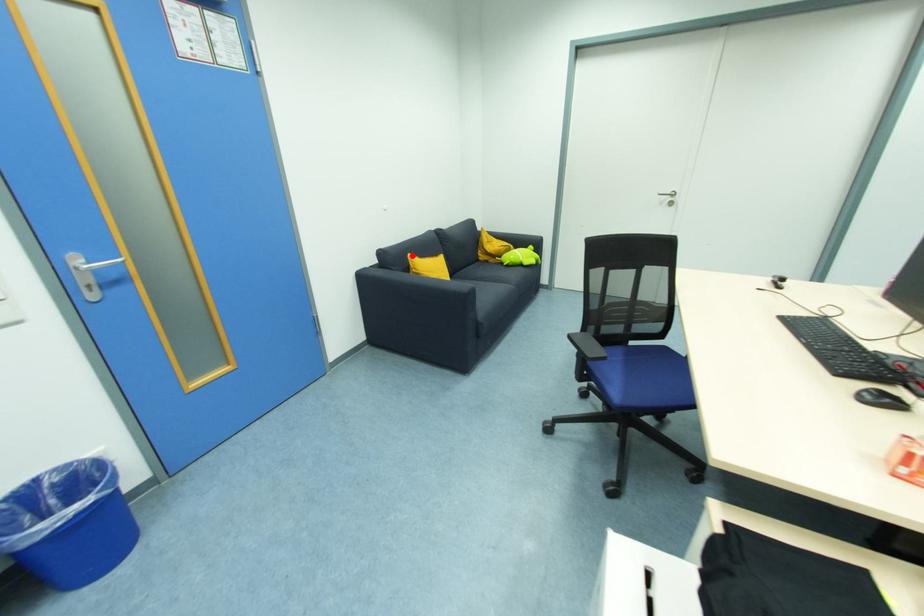
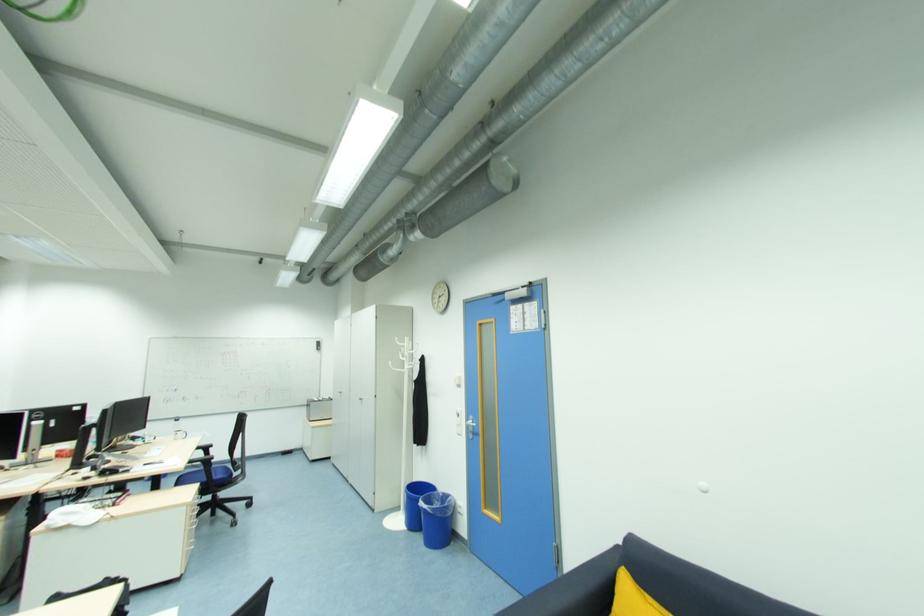
Question: I am providing you with two images of the same scene from different viewpoints. Given a red point in image1, look at the same physical point in image2. Is it:

Choices:
 (A) Closer to the viewpoint
 (B) Farther from the viewpoint

Answer: (B)